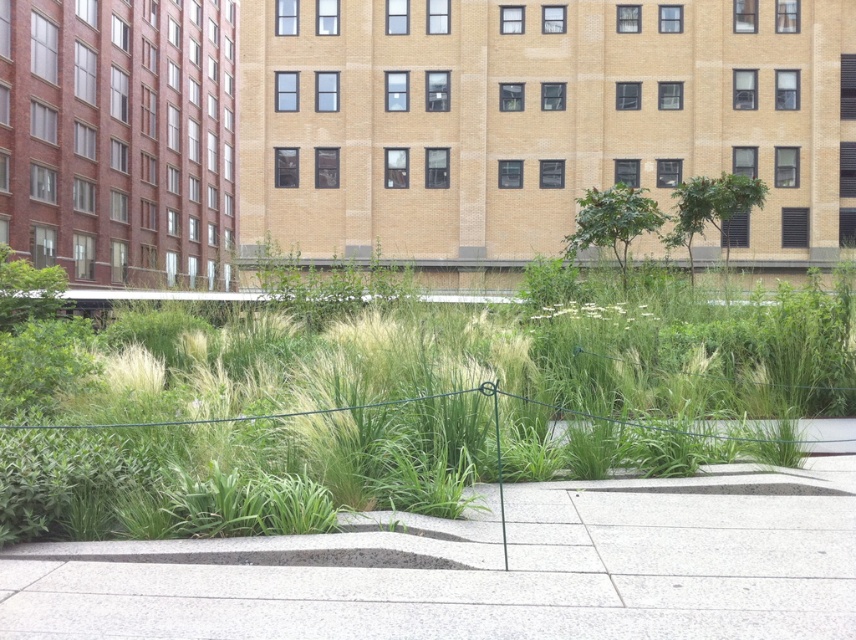
Does green grass at lower left appear on the right side of gray concrete pavement at center?

Incorrect, green grass at lower left is not on the right side of gray concrete pavement at center.

Locate an element on the screen. green grass at lower left is located at coordinates (391, 406).

The image size is (856, 640). I want to click on green grass at lower left, so click(x=391, y=406).